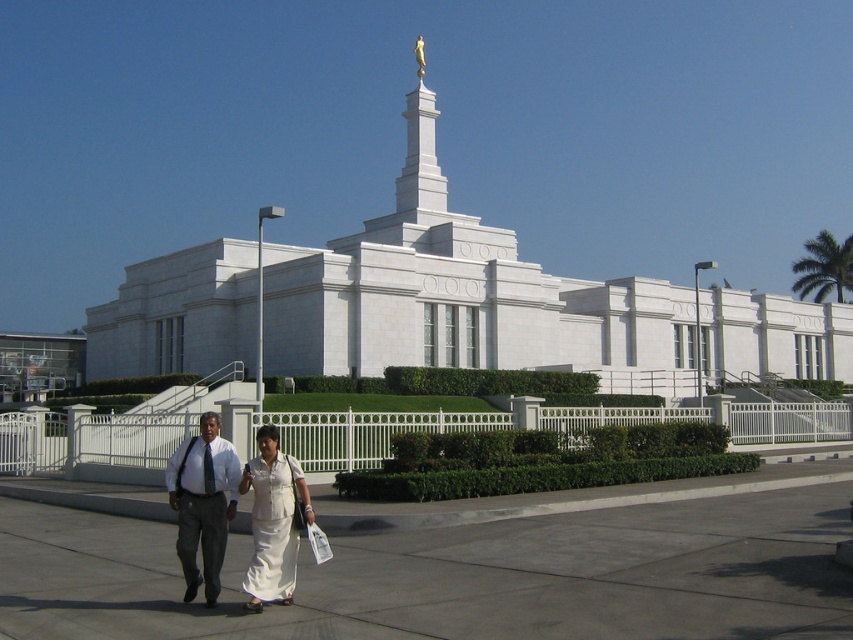
Question: Which point is farther from the camera taking this photo?

Choices:
 (A) (262, 440)
 (B) (51, 560)
 (C) (218, 529)

Answer: (B)

Question: Which point is farther to the camera?

Choices:
 (A) white cotton dress at center
 (B) gray concrete pavement at center

Answer: (A)

Question: Is gray concrete pavement at center further to camera compared to white cotton dress at center?

Choices:
 (A) no
 (B) yes

Answer: (A)

Question: Does gray concrete pavement at center appear on the left side of gray fabric pants at lower left?

Choices:
 (A) yes
 (B) no

Answer: (B)

Question: Which is farther from the white cotton dress at center?

Choices:
 (A) gray concrete pavement at center
 (B) gray fabric pants at lower left

Answer: (A)

Question: Observing the image, what is the correct spatial positioning of gray fabric pants at lower left in reference to white cotton dress at center?

Choices:
 (A) left
 (B) right

Answer: (A)